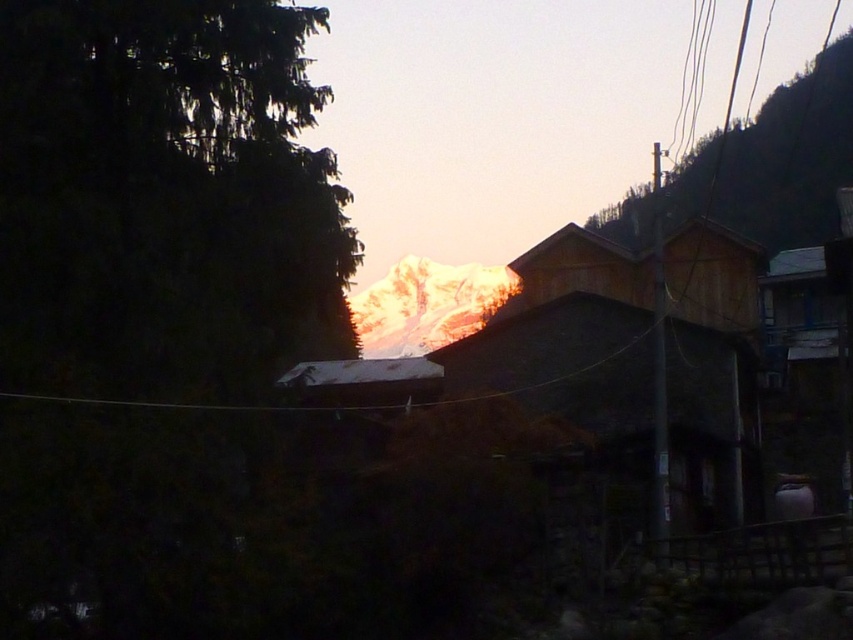
Question: Which object is farther from the camera taking this photo?

Choices:
 (A) green textured hillside at upper right
 (B) green matte tree at left
 (C) wooden hut at center

Answer: (A)

Question: Which of the following is the closest to the observer?

Choices:
 (A) wooden hut at center
 (B) green matte tree at left
 (C) green textured hillside at upper right

Answer: (B)

Question: Which point is farther to the camera?

Choices:
 (A) (253, 227)
 (B) (703, 225)
 (C) (815, 144)

Answer: (C)

Question: Can you confirm if green matte tree at left is smaller than wooden hut at center?

Choices:
 (A) no
 (B) yes

Answer: (B)

Question: Can you confirm if green matte tree at left is bigger than wooden hut at center?

Choices:
 (A) no
 (B) yes

Answer: (A)

Question: Can you confirm if green matte tree at left is wider than wooden hut at center?

Choices:
 (A) yes
 (B) no

Answer: (B)